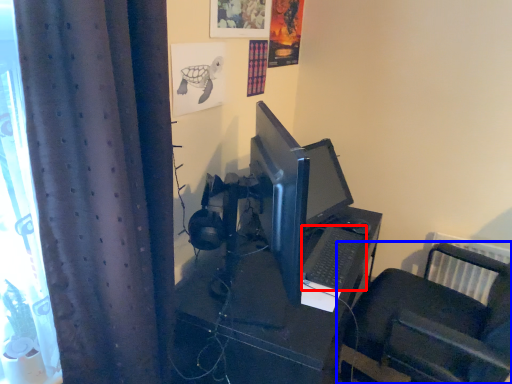
Question: Which object is closer to the camera taking this photo, computer keyboard (highlighted by a red box) or furniture (highlighted by a blue box)?

Choices:
 (A) computer keyboard
 (B) furniture

Answer: (A)